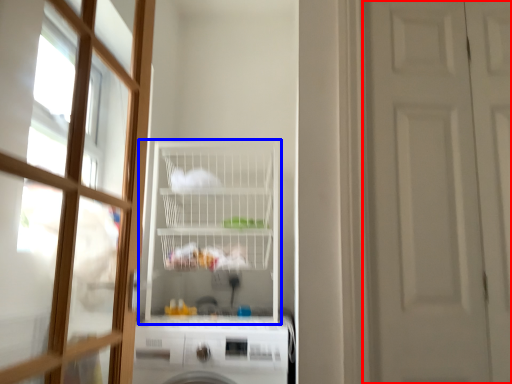
Question: Which object is further to the camera taking this photo, door (highlighted by a red box) or shelf (highlighted by a blue box)?

Choices:
 (A) door
 (B) shelf

Answer: (B)